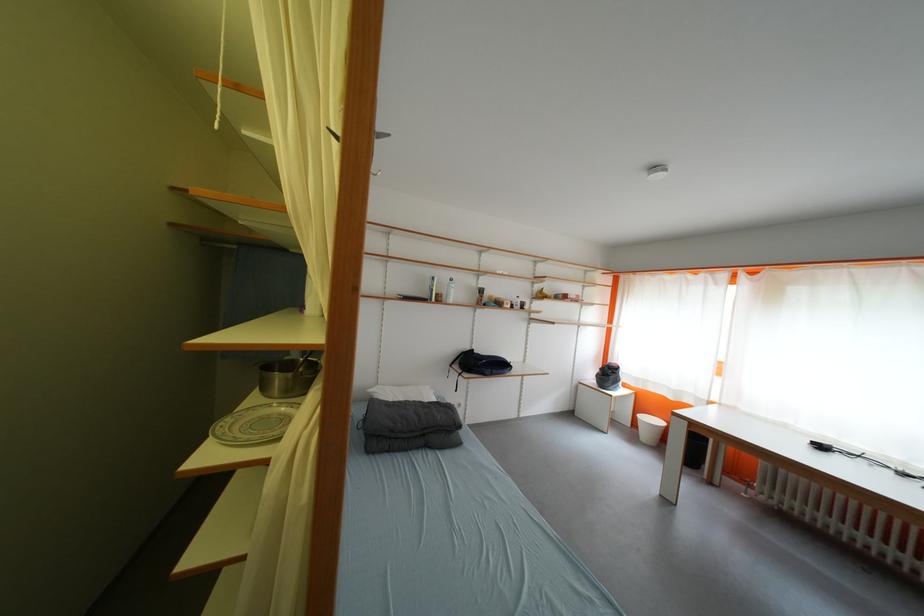
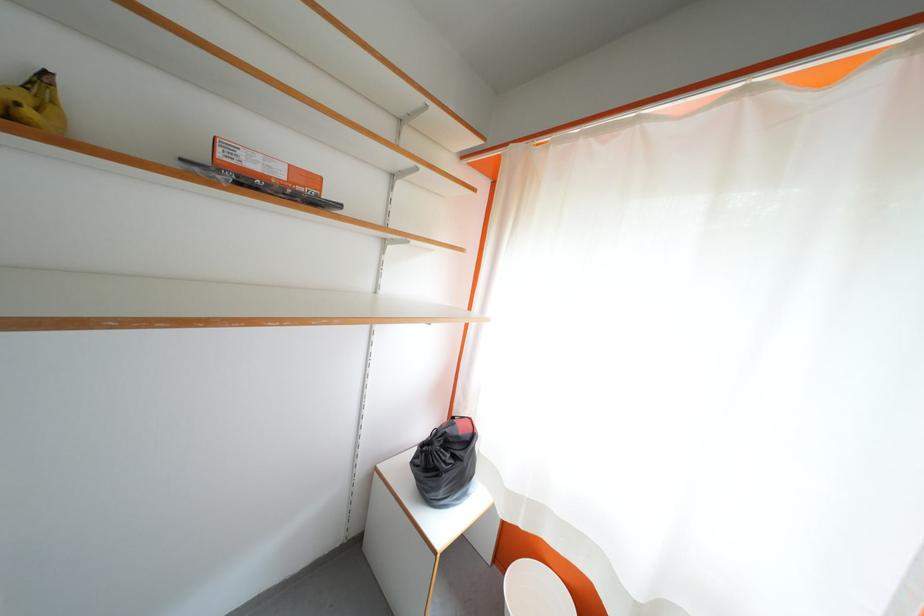
The point at (617,378) is marked in the first image. Where is the corresponding point in the second image?

(455, 460)